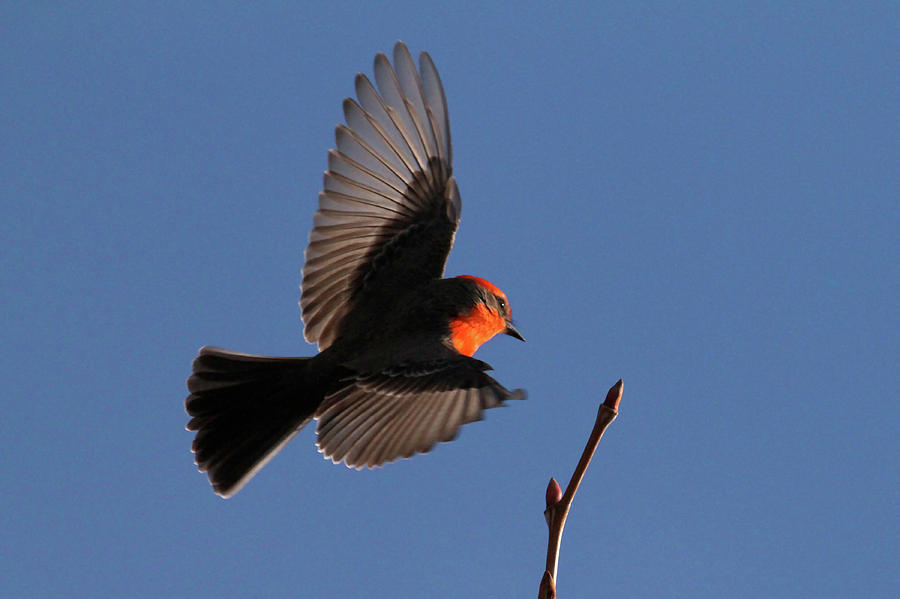
The height and width of the screenshot is (599, 900). Find the location of `brownish-green plant stems`. brownish-green plant stems is located at coordinates (545, 550), (587, 458).